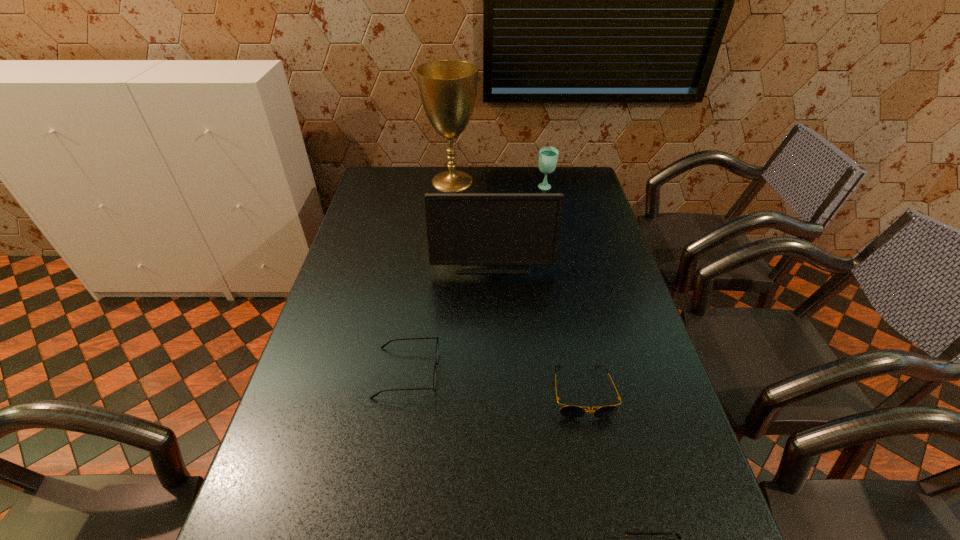
Where is `vacant region located 0.330m on the front-facing side of the left spectacles`? The image size is (960, 540). vacant region located 0.330m on the front-facing side of the left spectacles is located at coordinates (568, 373).

Where is `free space located 0.150m on the lenses of the sunglasses`? free space located 0.150m on the lenses of the sunglasses is located at coordinates (601, 487).

Identify the location of trophy cup at the far edge. This screenshot has height=540, width=960. (448, 88).

Identify the location of glass that is at the far edge. The height and width of the screenshot is (540, 960). (548, 156).

What are the coordinates of `glass present at the right edge` in the screenshot? It's located at 548,156.

Where is `sunglasses that is at the right edge`? Image resolution: width=960 pixels, height=540 pixels. sunglasses that is at the right edge is located at coordinates (569, 411).

Where is `object at the far right corner`? This screenshot has height=540, width=960. object at the far right corner is located at coordinates (548, 156).

Find the location of a particular element. The height and width of the screenshot is (540, 960). free space at the left edge of the desktop is located at coordinates (312, 347).

Identify the location of free spot at the right edge of the desktop. (683, 511).

The image size is (960, 540). In order to click on free space at the far right corner in this screenshot , I will do `click(568, 175)`.